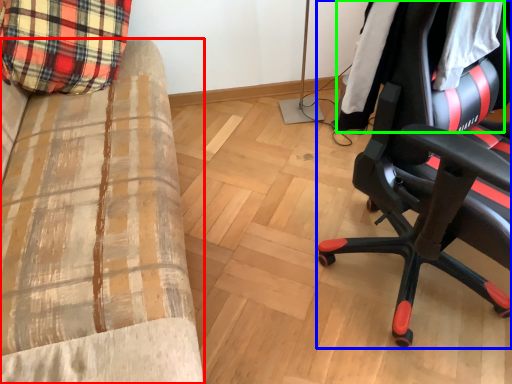
Question: Considering the real-world distances, which object is closest to furniture (highlighted by a red box)? chair (highlighted by a blue box) or clothing (highlighted by a green box).

Choices:
 (A) chair
 (B) clothing

Answer: (A)